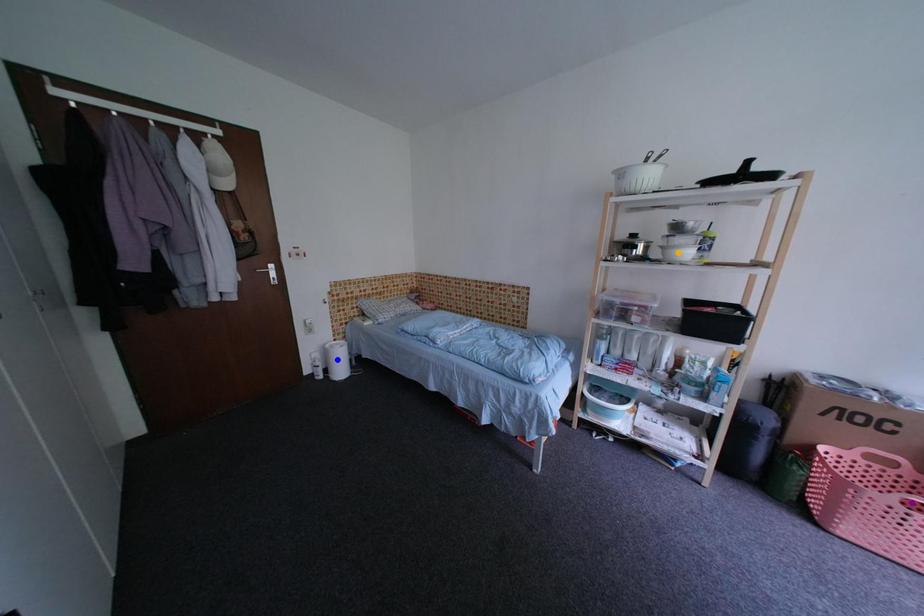
Order these from nearest to farthest:
- blue point
- purple point
- orange point

purple point < orange point < blue point